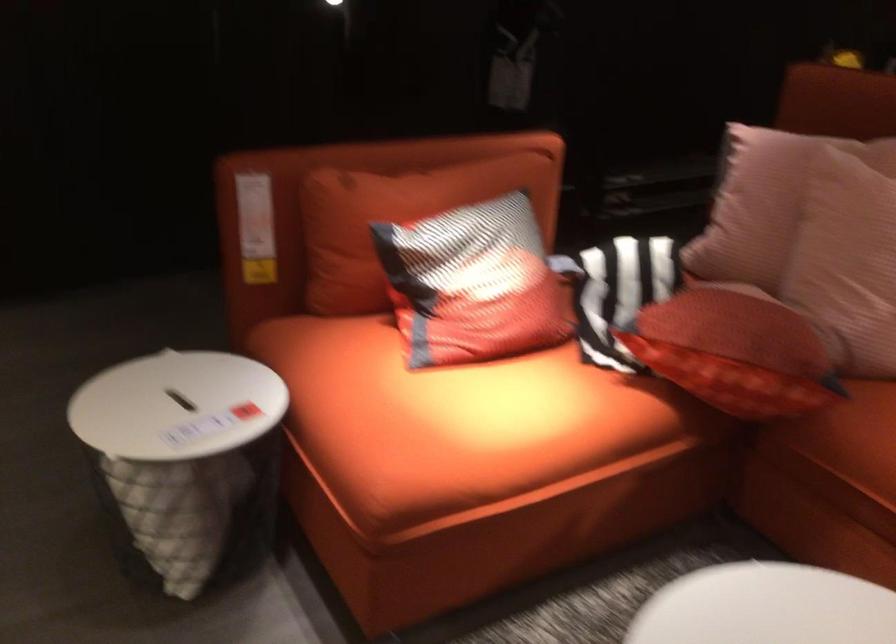
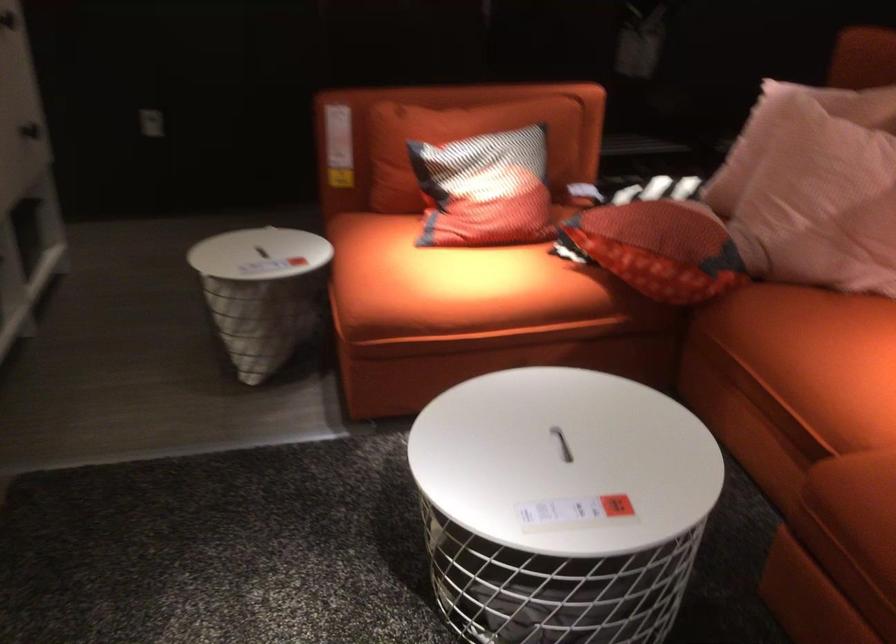
In the second image, find the point that corresponds to point 485,287 in the first image.

(485, 190)